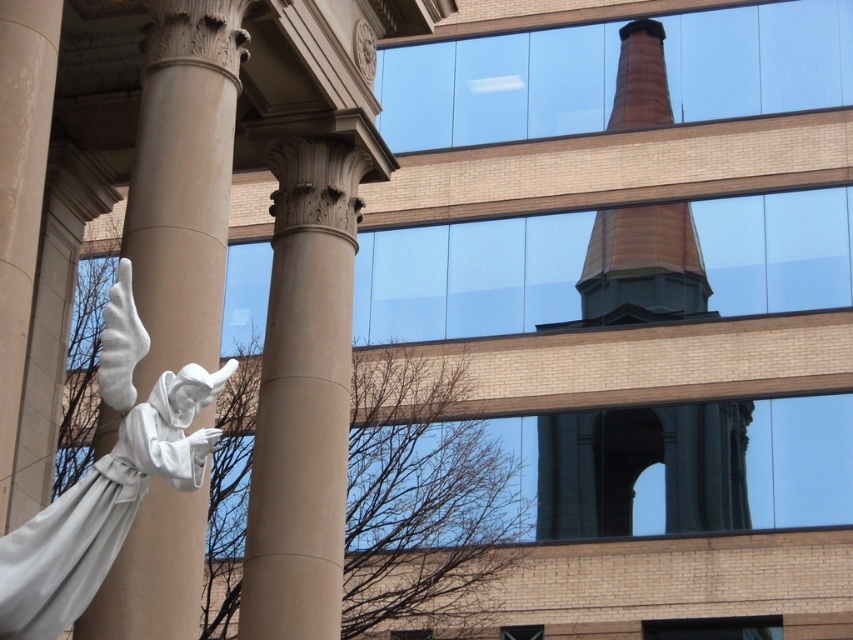
Locate an element on the screen. The height and width of the screenshot is (640, 853). white marble column at left is located at coordinates (183, 179).

Find the location of a particular element. white marble column at left is located at coordinates (183, 179).

Locate an element on the screen. This screenshot has height=640, width=853. white marble column at left is located at coordinates (183, 179).

Does smooth beige column at center come behind brown brick bell tower at upper center?

That is False.

Is point (254, 490) farther from viewer compared to point (643, 61)?

No, it is in front of (643, 61).

This screenshot has width=853, height=640. I want to click on smooth beige column at center, so click(x=303, y=396).

Can you confirm if brown brick bell tower at upper center is thinner than white marble statue at left?

Incorrect, brown brick bell tower at upper center's width is not less than white marble statue at left's.

Does brown brick bell tower at upper center have a greater height compared to white marble statue at left?

Yes, brown brick bell tower at upper center is taller than white marble statue at left.

Locate an element on the screen. This screenshot has height=640, width=853. brown brick bell tower at upper center is located at coordinates (642, 468).